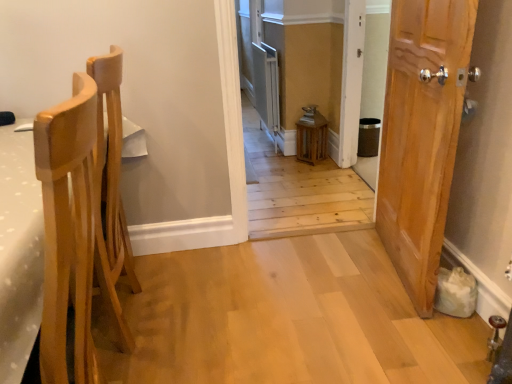
At what (x,y) coordinates should I click in order to perform the action: click on light wood chair at left. Please return your answer as a coordinate pair (x, y). Looking at the image, I should click on (72, 235).

Is light wood chair at left at the right side of wooden door at right?

In fact, light wood chair at left is to the left of wooden door at right.

Is wooden door at right located within light wood chair at left?

That's incorrect, wooden door at right is not inside light wood chair at left.

Is light wood chair at left looking in the opposite direction of wooden door at right?

No, light wood chair at left's orientation is not away from wooden door at right.

From a real-world perspective, which is physically below, wooden lantern at center or light wood chair at left?

In real-world perspective, light wood chair at left is lower.

Considering the relative sizes of wooden lantern at center and light wood chair at left in the image provided, is wooden lantern at center thinner than light wood chair at left?

Yes, wooden lantern at center is thinner than light wood chair at left.

Find the location of a particular element. The height and width of the screenshot is (384, 512). chair on the left of the wooden lantern at center is located at coordinates (72, 235).

Find the location of a particular element. The height and width of the screenshot is (384, 512). door in front of the wooden lantern at center is located at coordinates (421, 135).

From a real-world perspective, is wooden lantern at center physically above wooden door at right?

Yes, from a real-world perspective, wooden lantern at center is on top of wooden door at right.

Consider the image. Does wooden lantern at center have a smaller size compared to wooden door at right?

Correct, wooden lantern at center occupies less space than wooden door at right.

Looking at this image, is wooden lantern at center to the right of wooden door at right from the viewer's perspective?

In fact, wooden lantern at center is to the left of wooden door at right.

Is point (426, 218) closer to viewer compared to point (302, 82)?

Yes.

Which object is closer to the camera, wooden door at right or wooden lantern at center?

wooden door at right is in front.

Are wooden door at right and wooden lantern at center beside each other?

wooden door at right is not next to wooden lantern at center, and they're not touching.

From the image's perspective, would you say wooden door at right is positioned over wooden lantern at center?

Incorrect, from the image's perspective, wooden door at right is lower than wooden lantern at center.

Is there a large distance between wooden door at right and light wood chair at left?

wooden door at right is positioned a significant distance from light wood chair at left.

Is wooden door at right inside or outside of light wood chair at left?

wooden door at right is not enclosed by light wood chair at left.

Does point (447, 118) lie behind point (55, 298)?

Yes, point (447, 118) is behind point (55, 298).

Based on the photo, which of these two, wooden door at right or light wood chair at left, stands taller?

wooden door at right is taller.

From a real-world perspective, is light wood chair at left above or below wooden lantern at center?

light wood chair at left is below wooden lantern at center.

Considering the sizes of light wood chair at left and wooden lantern at center in the image, is light wood chair at left wider or thinner than wooden lantern at center?

Considering their sizes, light wood chair at left looks broader than wooden lantern at center.

In order to click on corridor behind the light wood chair at left in this screenshot , I will do `click(307, 66)`.

Which is in front, point (76, 227) or point (359, 93)?

The point (76, 227) is more forward.

Image resolution: width=512 pixels, height=384 pixels. In order to click on door above the light wood chair at left (from the image's perspective) in this screenshot , I will do `click(421, 135)`.

Find the location of `corridor on the right of light wood chair at left`. corridor on the right of light wood chair at left is located at coordinates (307, 66).

Looking at this image, based on their spatial positions, is wooden door at right or light wood chair at left closer to wooden lantern at center?

The object closer to wooden lantern at center is wooden door at right.

Looking at the image, which one is located further to wooden lantern at center, light wood chair at left or wooden door at right?

The object further to wooden lantern at center is light wood chair at left.

Consider the image. Based on their spatial positions, is light wood chair at left or wooden lantern at center closer to wooden door at right?

Based on the image, light wood chair at left appears to be nearer to wooden door at right.

From the image, which object appears to be farther from light wood chair at left, wooden door at right or wooden lantern at center?

wooden lantern at center lies further to light wood chair at left than the other object.

Estimate the real-world distances between objects in this image. Which object is further from wooden door at right, wooden lantern at center or light wood chair at left?

wooden lantern at center.

Which object lies nearer to the anchor point light wood chair at left, wooden lantern at center or wooden door at right?

wooden door at right lies closer to light wood chair at left than the other object.

I want to click on corridor located between light wood chair at left and wooden door at right in the left-right direction, so click(307, 66).